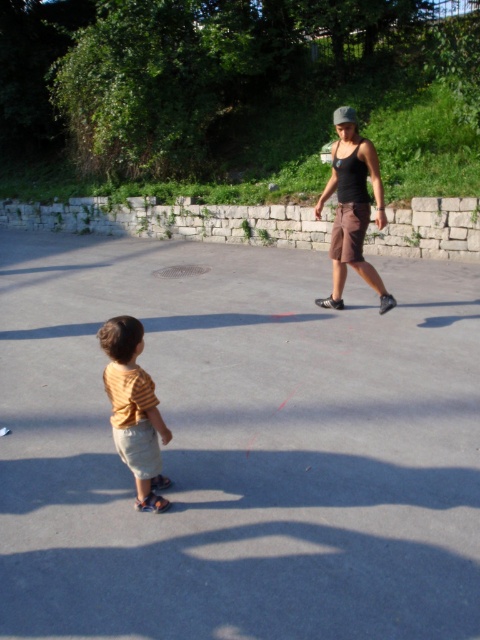
Who is higher up, yellow striped shirt at left or black matte tank top at center?

black matte tank top at center

Does yellow striped shirt at left have a greater height compared to black matte tank top at center?

No, yellow striped shirt at left is not taller than black matte tank top at center.

Between point (116, 326) and point (349, 116), which one is positioned behind?

Point (349, 116)

Identify the location of yellow striped shirt at left. (133, 410).